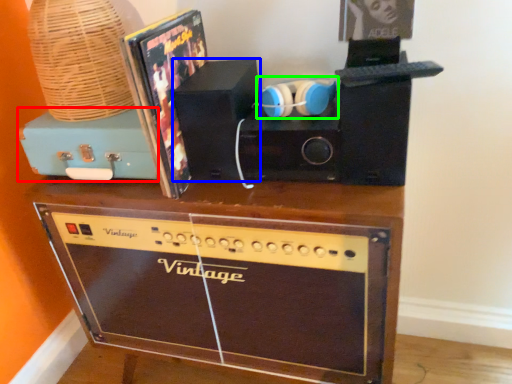
Question: Which is nearer to the cassette (highlighted by a red box)? speaker (highlighted by a blue box) or headphones (highlighted by a green box).

Choices:
 (A) speaker
 (B) headphones

Answer: (A)